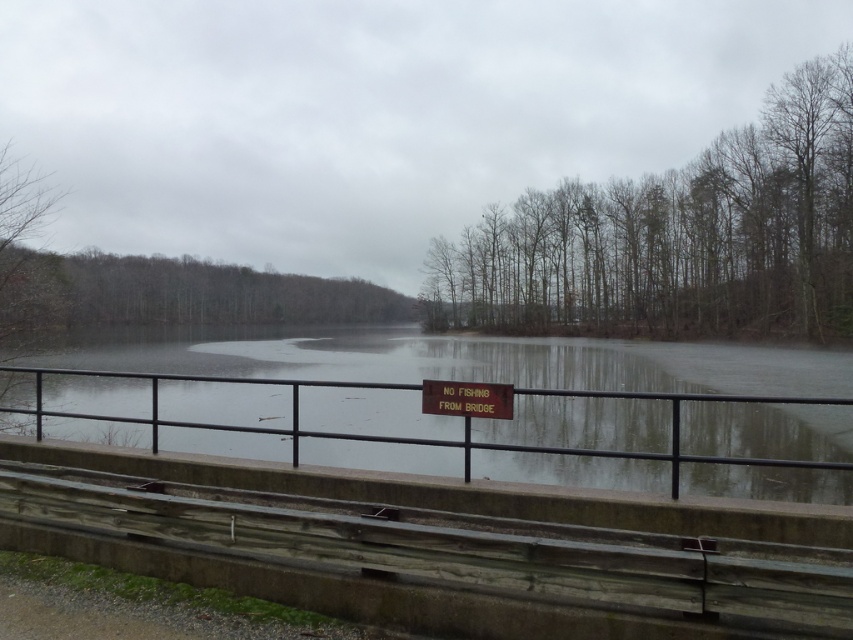
You are standing on the concrete barrier with the metal railing and see the smooth concrete river at center. According to the sign, where should you not fish from?

The sign states that you should not fish from the bridge, so you should avoid fishing from the smooth concrete river at center which is located at point (x=490, y=362).